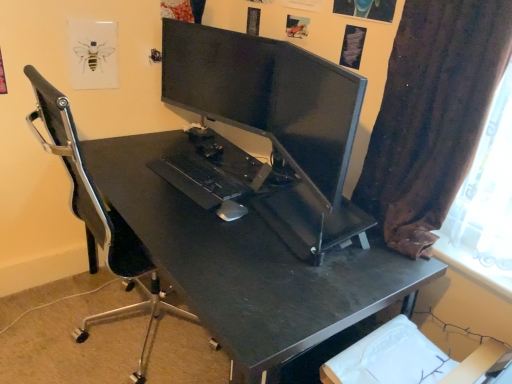
You are a GUI agent. You are given a task and a screenshot of the screen. Output one action in this format:
    pyautogui.click(x=<x>, y=<y>)
    Task: Click on the vacant area situated to the left side of white matte mouse at center
    Image resolution: width=512 pixels, height=384 pixels.
    Given the screenshot: What is the action you would take?
    pyautogui.click(x=181, y=209)